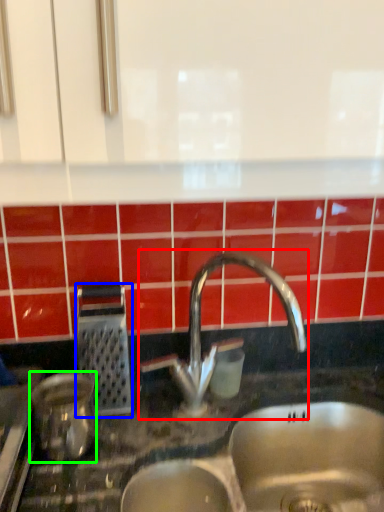
Question: Considering the real-world distances, which object is farthest from tap (highlighted by a red box)? appliance (highlighted by a blue box) or appliance (highlighted by a green box)?

Choices:
 (A) appliance
 (B) appliance

Answer: (B)